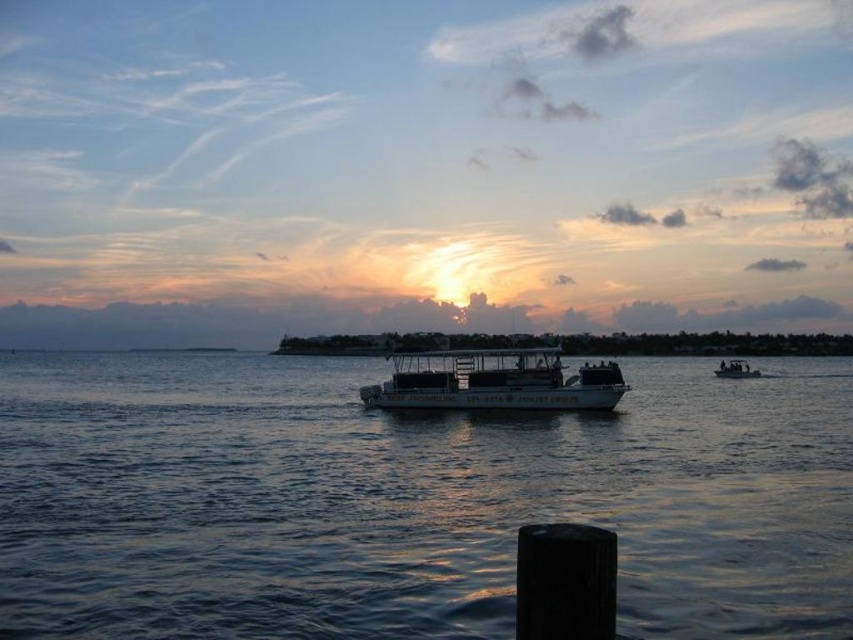
Question: Can you confirm if white matte boat at center is thinner than dark gray metallic boat at center?

Choices:
 (A) yes
 (B) no

Answer: (A)

Question: Which object is positioned closest to the white matte boat at center?

Choices:
 (A) dark gray metallic boat at center
 (B) dark blue water at center

Answer: (B)

Question: Which object appears closest to the camera in this image?

Choices:
 (A) dark gray metallic boat at center
 (B) white matte boat at center
 (C) dark blue water at center

Answer: (C)

Question: Does dark blue water at center appear on the right side of dark gray metallic boat at center?

Choices:
 (A) yes
 (B) no

Answer: (B)

Question: Does dark blue water at center lie in front of white matte boat at center?

Choices:
 (A) no
 (B) yes

Answer: (B)

Question: Which of the following is the farthest from the observer?

Choices:
 (A) dark blue water at center
 (B) white matte boat at center
 (C) dark gray metallic boat at center

Answer: (C)